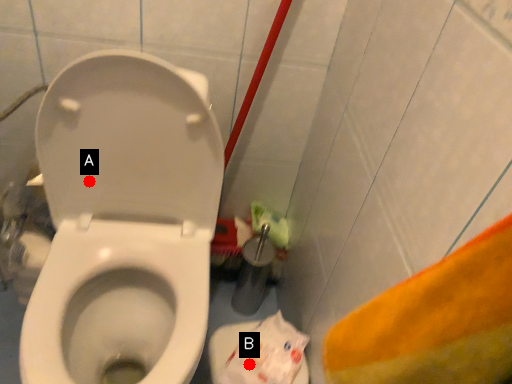
Question: Two points are circled on the image, labeled by A and B beside each circle. Which of the following is the closest to the observer?

Choices:
 (A) A is closer
 (B) B is closer

Answer: (A)